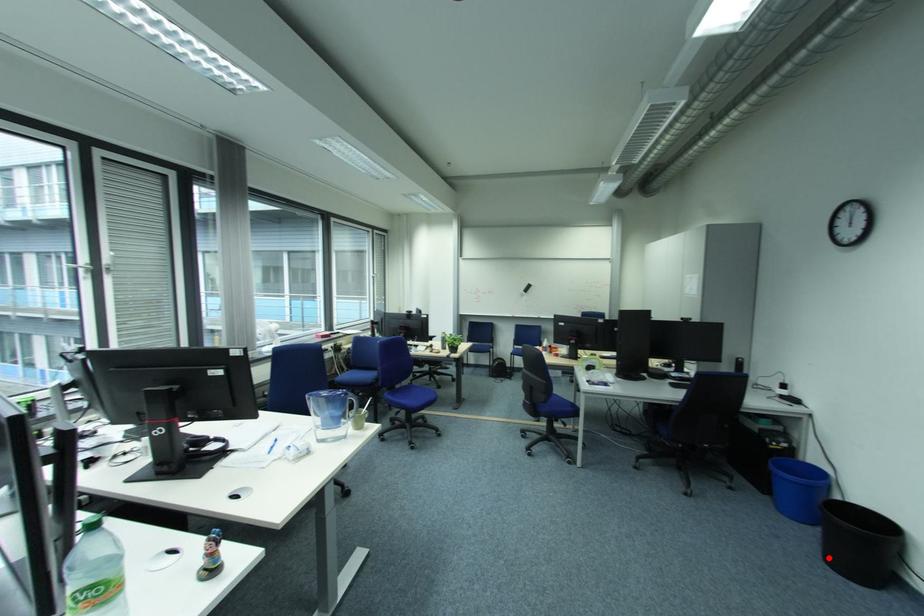
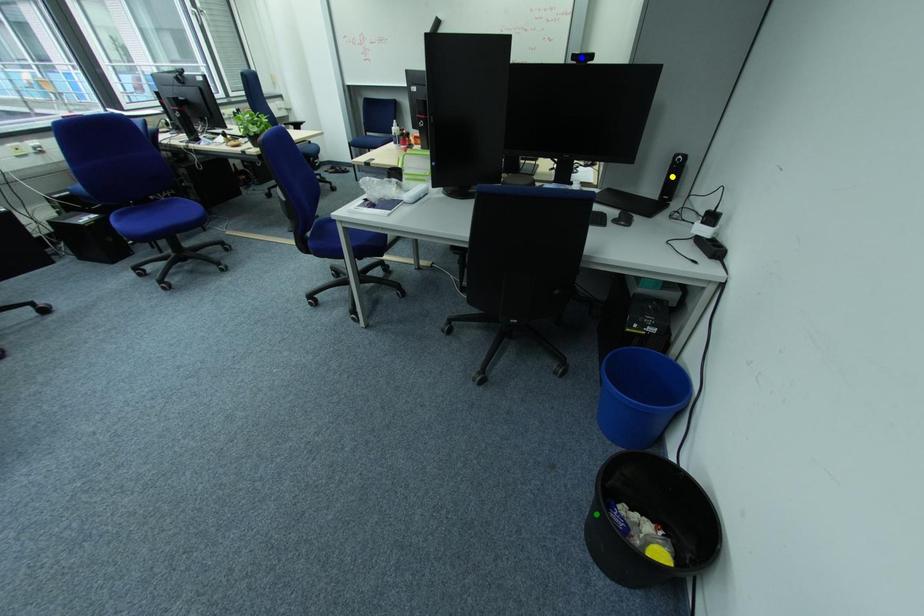
Question: I am providing you with two images of the same scene from different viewpoints. A red point is marked on the first image. You are given multiple points on the second image. In image 2, which mark is for the same physical point as the one in image 1?

Choices:
 (A) blue point
 (B) green point
 (C) yellow point

Answer: (B)